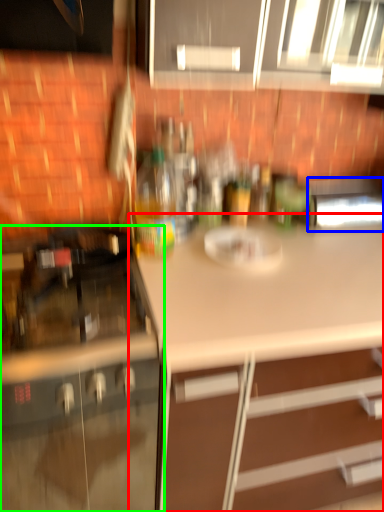
Question: Which object is the closest to the countertop (highlighted by a red box)? Choose among these: appliance (highlighted by a blue box) or cabinetry (highlighted by a green box).

Choices:
 (A) appliance
 (B) cabinetry

Answer: (B)